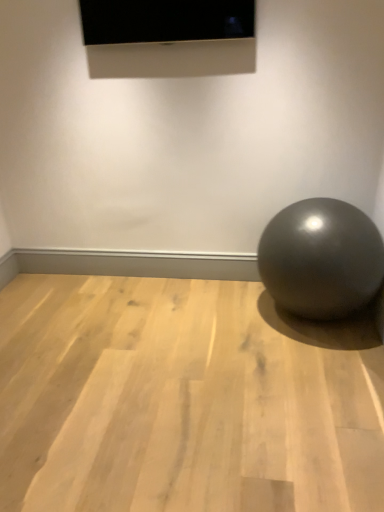
You are a GUI agent. You are given a task and a screenshot of the screen. Output one action in this format:
    pyautogui.click(x=<x>, y=<y>)
    Task: Click on the free location above light wood floor at center (from a real-world perspective)
    
    Given the screenshot: What is the action you would take?
    pyautogui.click(x=147, y=352)